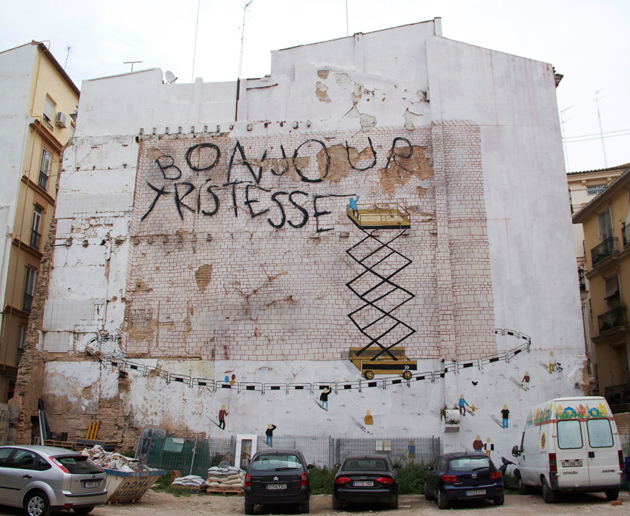
At what (x,y) coordinates should I click in order to perform the action: click on window. Please return your answer as a coordinate pair (x, y). Image resolution: width=630 pixels, height=516 pixels. Looking at the image, I should click on (593, 427), (562, 436), (466, 465), (375, 463), (273, 459), (67, 465), (18, 461), (4, 455).